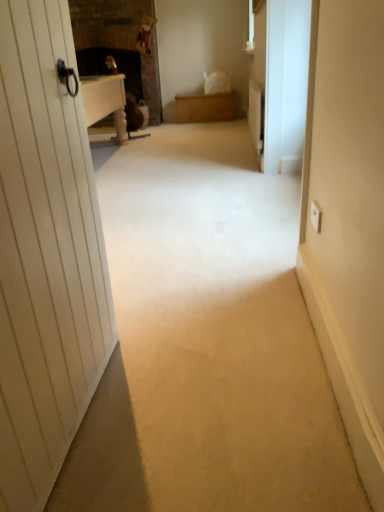
Question: Is wooden chest at center in front of or behind white matte screen door at right in the image?

Choices:
 (A) front
 (B) behind

Answer: (B)

Question: In terms of size, does wooden chest at center appear bigger or smaller than white matte screen door at right?

Choices:
 (A) small
 (B) big

Answer: (B)

Question: Which object is positioned farthest from the white matte screen door at right?

Choices:
 (A) wooden chest at center
 (B) polished brass door handle at upper left

Answer: (A)

Question: Which of these objects is positioned closest to the wooden chest at center?

Choices:
 (A) polished brass door handle at upper left
 (B) white matte screen door at right

Answer: (B)